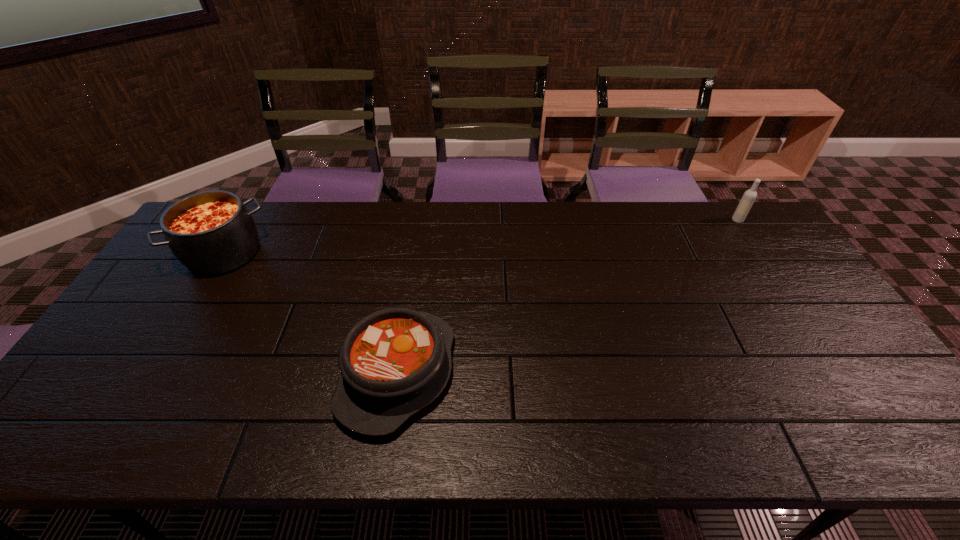
This screenshot has width=960, height=540. I want to click on free space between the farthest object and the right casserole, so click(567, 296).

Locate an element on the screen. This screenshot has width=960, height=540. free space between the leftmost object and the shorter casserole is located at coordinates (311, 313).

Locate an element on the screen. The width and height of the screenshot is (960, 540). free spot between the vodka and the taller casserole is located at coordinates (481, 237).

Find the location of `vacant space in between the farthest object and the farther casserole`. vacant space in between the farthest object and the farther casserole is located at coordinates (481, 237).

This screenshot has height=540, width=960. What are the coordinates of `free spot between the farthest object and the shortest object` in the screenshot? It's located at (567, 296).

Find the location of a particular element. Image resolution: width=960 pixels, height=540 pixels. free space between the taller casserole and the shorter casserole is located at coordinates (311, 313).

Where is `vacant space in between the shorter casserole and the rightmost object`? vacant space in between the shorter casserole and the rightmost object is located at coordinates (567, 296).

Locate an element on the screen. The image size is (960, 540). vacant space that is in between the farthest object and the left casserole is located at coordinates (481, 237).

You are a GUI agent. You are given a task and a screenshot of the screen. Output one action in this format:
    pyautogui.click(x=<x>, y=<y>)
    Task: Click on the free spot between the farther casserole and the vodka
    The width and height of the screenshot is (960, 540).
    Given the screenshot: What is the action you would take?
    [481, 237]

At what (x,y) coordinates should I click in order to perform the action: click on free space that is in between the shortest object and the rightmost object. Please return your answer as a coordinate pair (x, y). This screenshot has width=960, height=540. Looking at the image, I should click on (567, 296).